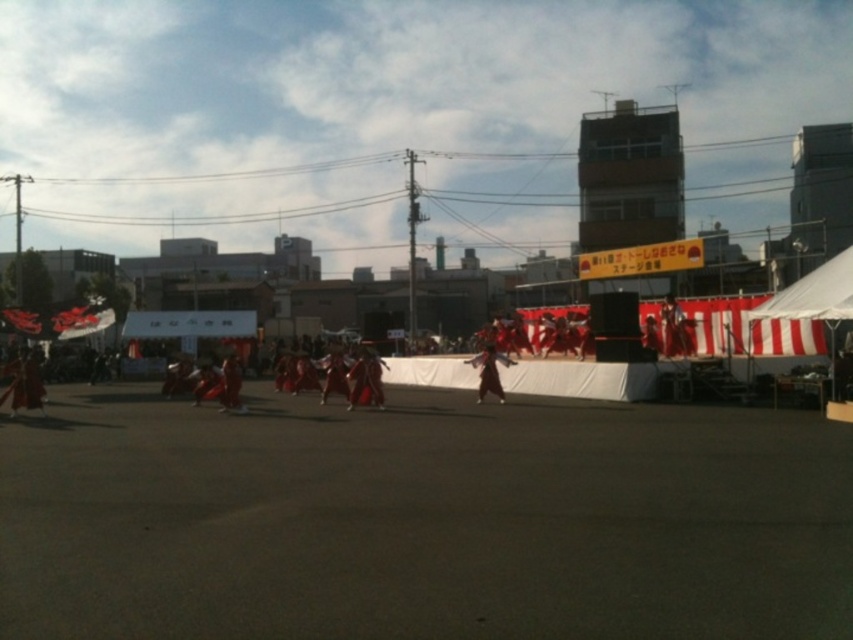
You are a photographer at the event and want to capture both the matte red kimono at center and the red silk kimono at center in a single shot. Which kimono will appear taller in your photo?

The matte red kimono at center will appear taller in the photo because it has a greater height compared to the red silk kimono at center.

You are standing in the courtyard and want to take a photo of the stage. There are two points marked on the stage at coordinates point (677, 312) and point (224, 358). Which point will appear larger in your photo?

Point (677, 312) is closer to the camera than point (224, 358), so it will appear larger in the photo.

You are a photographer positioned in front of the stage. You want to take a photo that captures both the red satin kimono at center and the red silk kimono at center. Which kimono will appear closer to the camera in the photo?

The red satin kimono at center will appear closer to the camera because it is positioned further to the viewer than the red silk kimono at center.